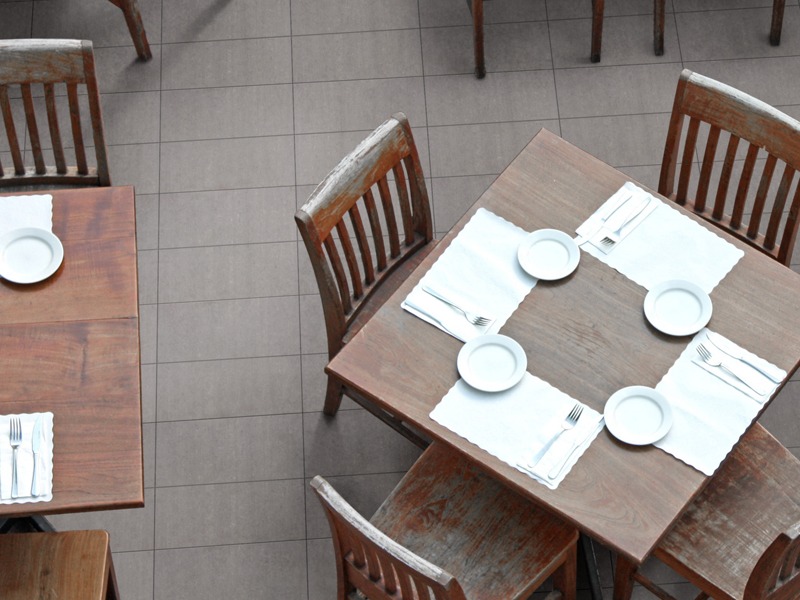
This screenshot has width=800, height=600. What are the coordinates of `plate` in the screenshot? It's located at (545, 265), (652, 298), (638, 412), (501, 373), (42, 273).